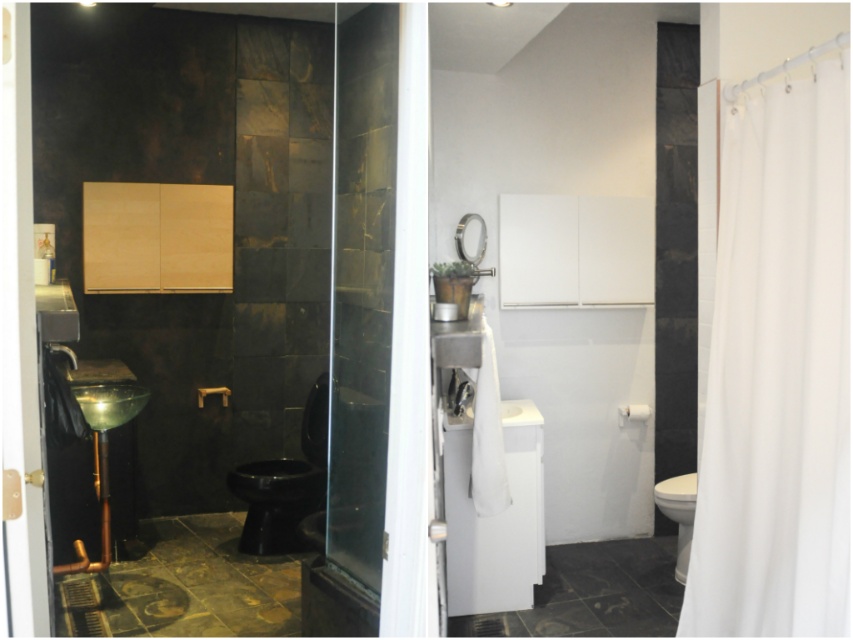
Consider the image. You are a plumber inspecting the bathroom. You need to access the white glossy toilet bowl at lower right for repairs. Is the green glass bowl at left blocking your access to it?

The green glass bowl at left is positioned over the white glossy toilet bowl at lower right, so it is blocking access to the toilet bowl. You will need to move or remove the green glass bowl at left to access the toilet bowl for repairs.

You are standing in the bathroom and want to exit through the transparent glass screen door at center. The white glossy toilet bowl at lower right is in your way. Can you move around it to reach the door?

The transparent glass screen door at center is closer to the viewer than the white glossy toilet bowl at lower right, so you can move around the white glossy toilet bowl at lower right to reach the door without obstruction.

You are designing a bathroom layout and need to ensure that the white fabric shower curtain at right and the transparent glass screen door at center are installed correctly. Based on their heights, which one should be placed lower to prevent water splashes from reaching the other?

The white fabric shower curtain at right has a lesser height compared to the transparent glass screen door at center, so it should be placed lower to prevent water splashes from reaching the transparent glass screen door at center.